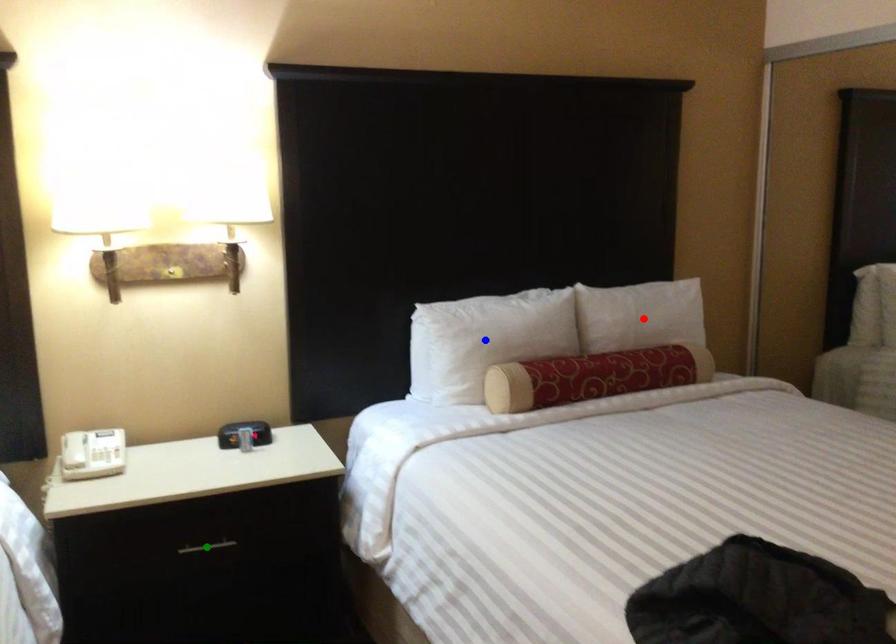
Order these from nearest to farthest:
blue point | red point | green point

1. green point
2. blue point
3. red point